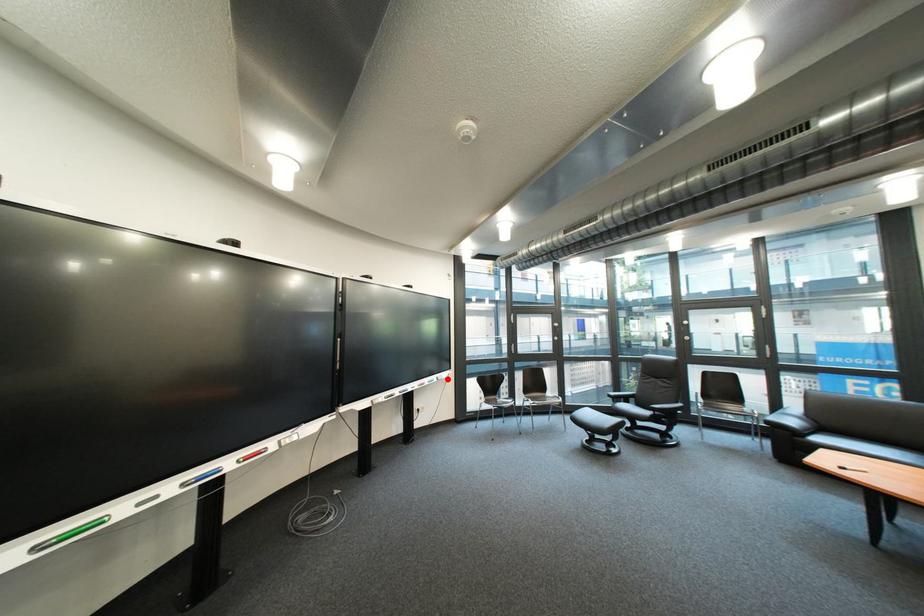
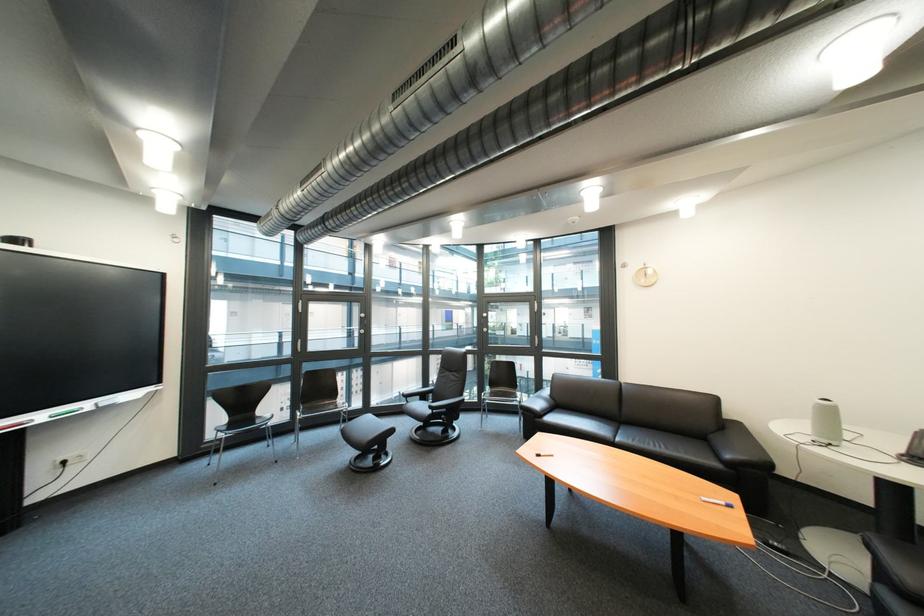
In the second image, find the point that corresponds to the highlighted location in the first image.

(101, 406)